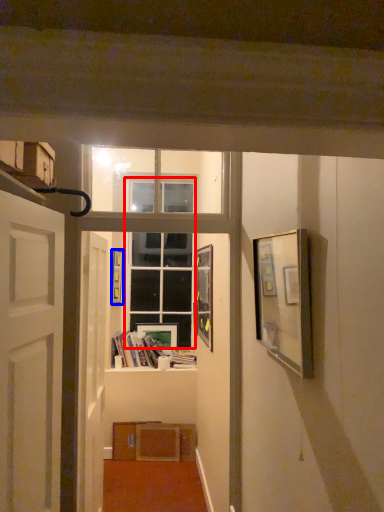
Question: Which of the following is the closest to the observer, glass door (highlighted by a red box) or picture frame (highlighted by a blue box)?

Choices:
 (A) glass door
 (B) picture frame

Answer: (B)